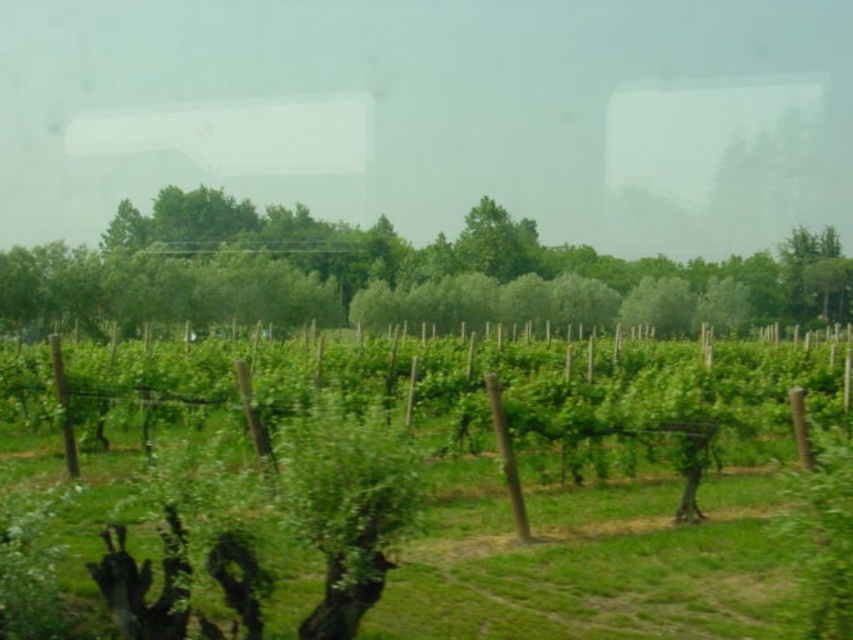
Question: Is green leafy vines at center bigger than green leafy tree at center?

Choices:
 (A) yes
 (B) no

Answer: (B)

Question: Which point is closer to the camera?

Choices:
 (A) green leafy vines at center
 (B) green leafy tree at center

Answer: (A)

Question: In this image, where is green leafy vines at center located relative to green leafy tree at center?

Choices:
 (A) above
 (B) below

Answer: (B)

Question: Does green leafy vines at center appear over green leafy tree at center?

Choices:
 (A) no
 (B) yes

Answer: (A)

Question: Which of the following is the farthest from the observer?

Choices:
 (A) green leafy tree at center
 (B) green leafy vines at center

Answer: (A)